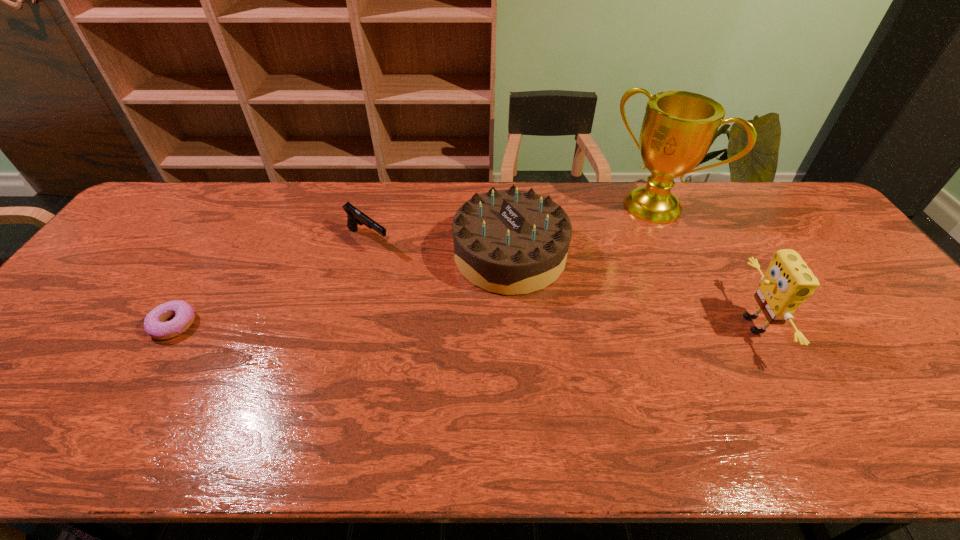
At what (x,y) coordinates should I click in order to perform the action: click on vacant region that satisfies the following two spatial constraints: 1. on the front side of the tallest object; 2. on the face of the second tallest object. Please return your answer as a coordinate pair (x, y). This screenshot has height=540, width=960. Looking at the image, I should click on (707, 325).